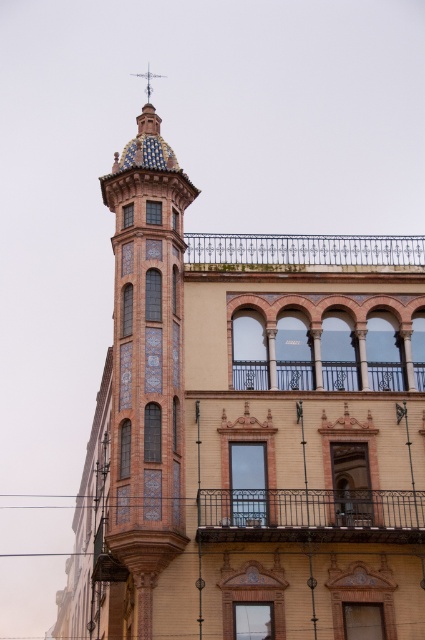
Which is more to the right, blue glazed tiles at center or rustic wrought iron balcony at center?

→ rustic wrought iron balcony at center

Is point (138, 435) positioned in front of point (348, 500)?

Yes.

Identify the location of blue glazed tiles at center. The image size is (425, 640). (146, 364).

Who is positioned more to the right, rustic wrought iron balcony at center or iron-forged balcony at center?

Positioned to the right is iron-forged balcony at center.

Consider the image. Can you confirm if rustic wrought iron balcony at center is smaller than iron-forged balcony at center?

Incorrect, rustic wrought iron balcony at center is not smaller in size than iron-forged balcony at center.

Describe the element at coordinates (309, 515) in the screenshot. The image size is (425, 640). I see `rustic wrought iron balcony at center` at that location.

Locate an element on the screen. The width and height of the screenshot is (425, 640). rustic wrought iron balcony at center is located at coordinates (309, 515).

Measure the distance between blue glazed tiles at center and black wrought iron balcony at center.

42.27 feet

Which of these two, blue glazed tiles at center or black wrought iron balcony at center, stands taller?

blue glazed tiles at center

Identify the location of blue glazed tiles at center. (146, 364).